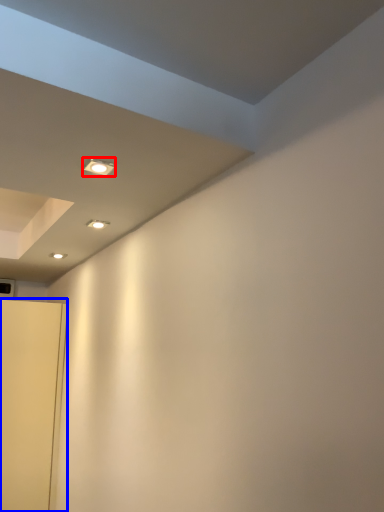
Question: Among these objects, which one is farthest to the camera, light fixture (highlighted by a red box) or door (highlighted by a blue box)?

Choices:
 (A) light fixture
 (B) door

Answer: (B)